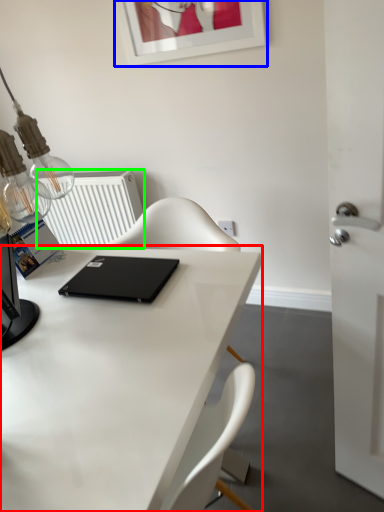
Question: Which is nearer to the desk (highlighted by a red box)? picture frame (highlighted by a blue box) or radiator (highlighted by a green box).

Choices:
 (A) picture frame
 (B) radiator

Answer: (B)